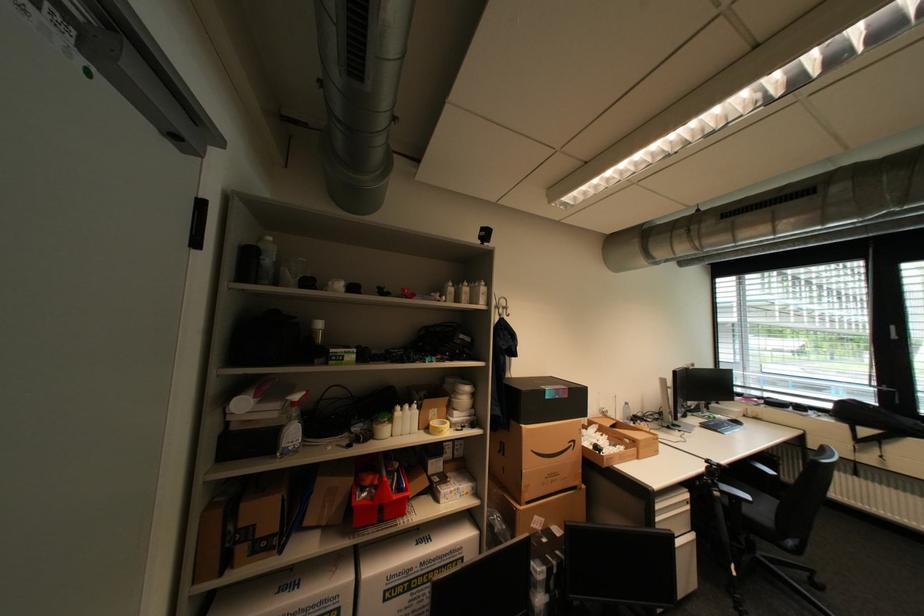
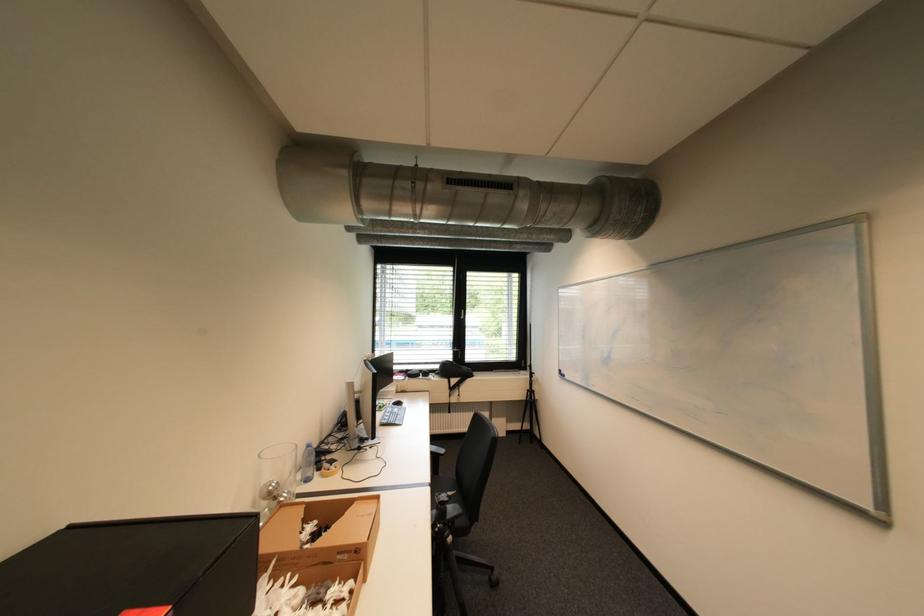
Find the pixel in the second image that matches (x=725, y=493) in the first image.

(458, 540)